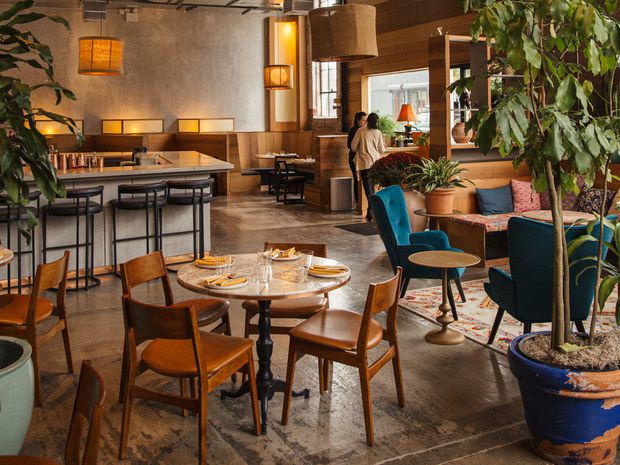
The width and height of the screenshot is (620, 465). I want to click on tables, so click(x=7, y=252), click(x=219, y=272), click(x=456, y=264), click(x=264, y=154), click(x=539, y=209).